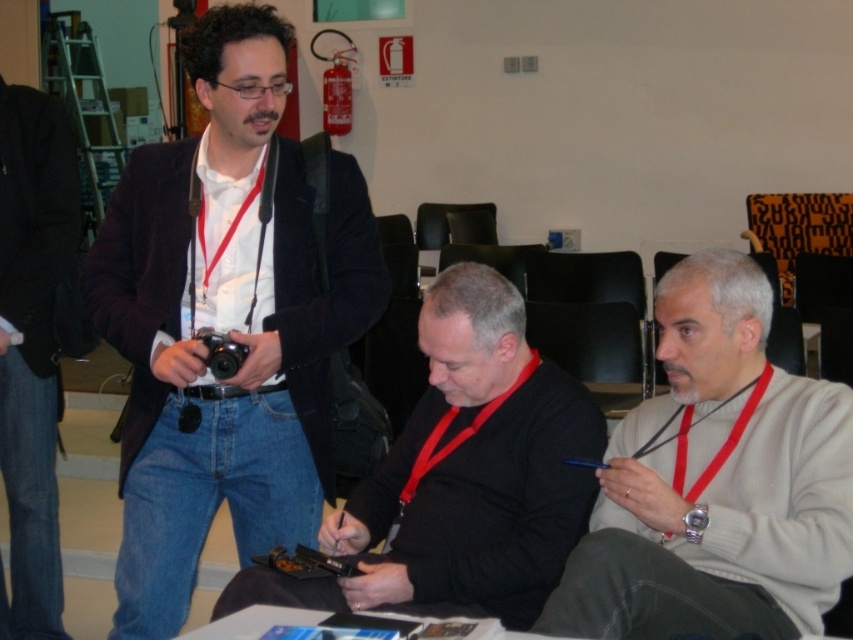
Question: Which point appears closest to the camera in this image?

Choices:
 (A) (665, 488)
 (B) (495, 433)
 (C) (303, 321)
 (D) (210, 362)

Answer: (A)

Question: Does matte black jacket at left appear on the left side of black leather jacket at left?

Choices:
 (A) no
 (B) yes

Answer: (A)

Question: Where is black matte sweater at center located in relation to white paper at lower center in the image?

Choices:
 (A) right
 (B) left

Answer: (A)

Question: Which of the following is the closest to the observer?

Choices:
 (A) matte black jacket at left
 (B) black plastic camera at center

Answer: (A)

Question: Is white paper at lower center to the right of black plastic camera at center from the viewer's perspective?

Choices:
 (A) yes
 (B) no

Answer: (A)

Question: Estimate the real-world distances between objects in this image. Which object is farther from the white paper at lower center?

Choices:
 (A) black plastic camera at center
 (B) black matte sweater at center
 (C) gray wool sweater at right

Answer: (A)